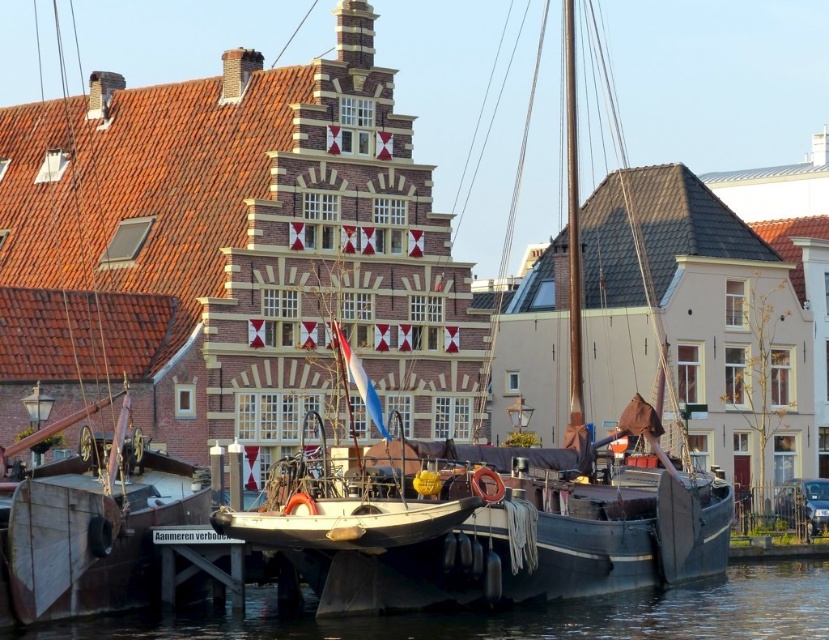
You are standing on the dock and want to board the wooden boat at left. Is the transparent water at lower center between you and the boat?

The wooden boat at left is in front of transparent water at lower center, so the transparent water at lower center is not between you and the boat. You can board the wooden boat at left without crossing the transparent water at lower center.

You are standing at the center of the harbor and want to board the wooden boat at left. Based on its 2D coordinates, in which direction should you walk to reach it?

The wooden boat at left is located at coordinates 0.517 on the x axis and 0.123 on the y axis. Since you are at the center, you should walk towards the left side of the harbor to reach the wooden boat at left.